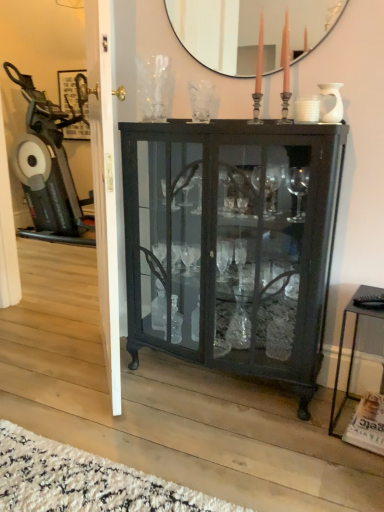
The height and width of the screenshot is (512, 384). In order to click on vacant space to the left of matte black cabinet at center in this screenshot , I will do `click(84, 389)`.